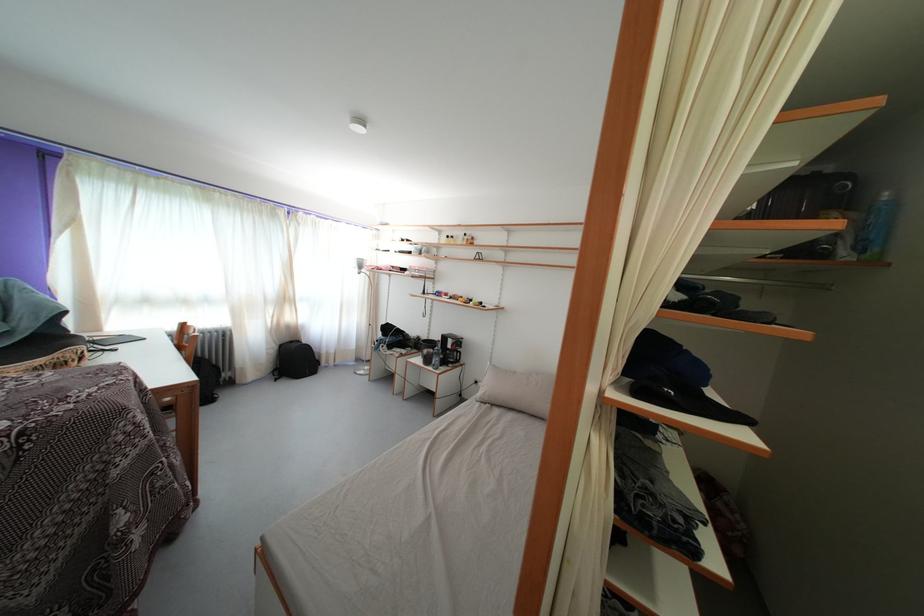
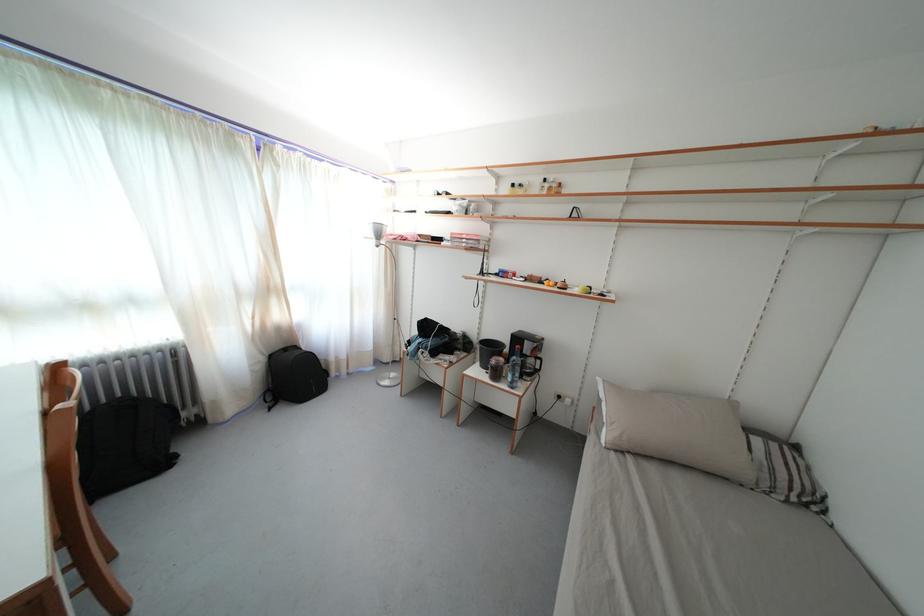
The point at (492, 405) is marked in the first image. Where is the corresponding point in the second image?

(630, 452)